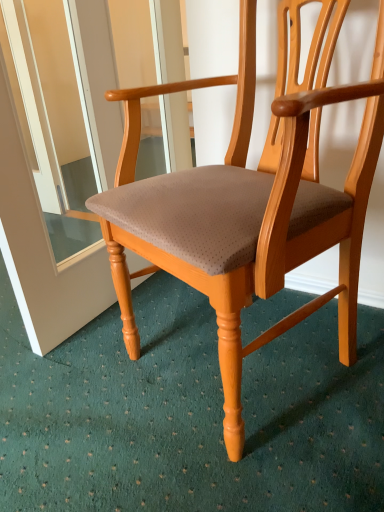
I want to click on vacant space positioned to the left of light brown wood chair at center, so click(x=63, y=394).